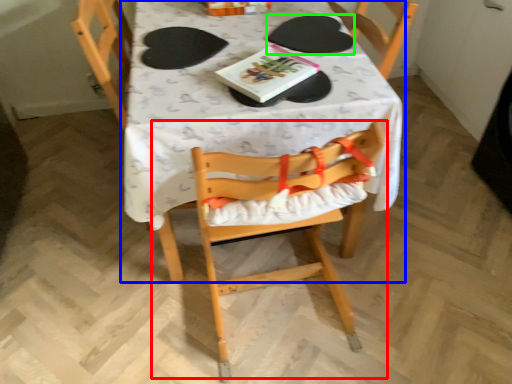
Question: Considering the real-world distances, which object is farthest from chair (highlighted by a red box)? table (highlighted by a blue box) or paper plate (highlighted by a green box)?

Choices:
 (A) table
 (B) paper plate

Answer: (B)